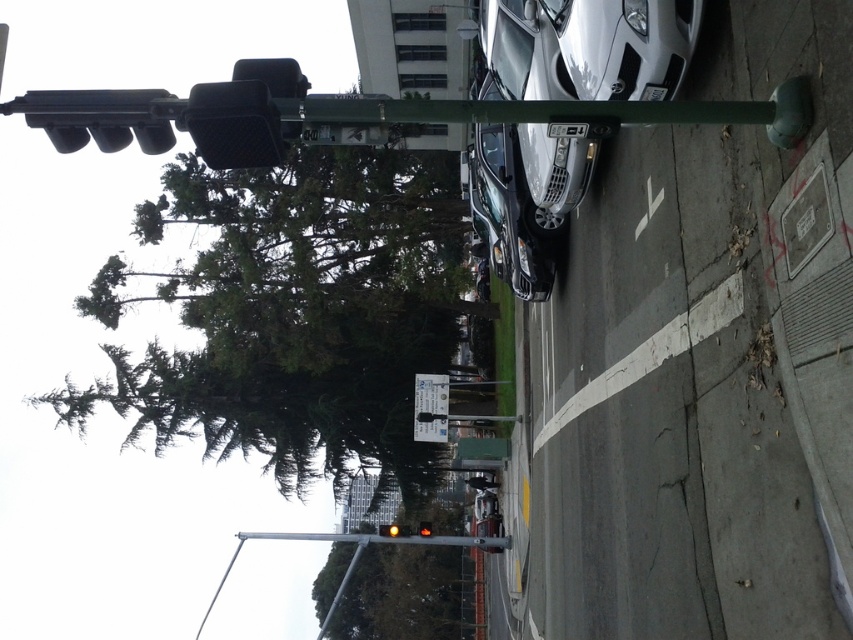
You are standing at the point with coordinates point (601, 20) and want to walk to point (405, 532). Which direction should you move relative to the traffic light pole?

Since point (601, 20) is in front of point (405, 532), you should move backward away from the traffic light pole to reach point (405, 532).

You are a delivery person trying to park your vehicle between the satin silver car at center and the yellow glass traffic light at center. Given that your vehicle is 4 meters long, can you fit it in the available space between them?

The satin silver car at center occupies less space than the yellow glass traffic light at center, but without knowing the exact distance between them, it is impossible to determine if the 4 meter vehicle can fit. Additional information about the spacing between the satin silver car at center and the yellow glass traffic light at center is required.

You are a pedestrian standing on the sidewalk looking down the street. You see a green leafy tree at center and an amber glass traffic light at upper center. Which object is closer to the left side of the street?

The green leafy tree at center is to the left of the amber glass traffic light at upper center, so it is closer to the left side of the street.